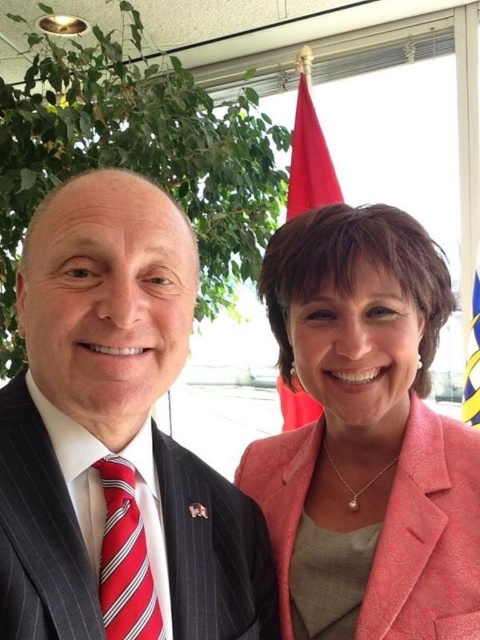
You are a photographer setting up for an event. You need to position a camera so that the pinstriped suit at center and the red fabric flag at upper center are both in frame. Based on their positions, which object should you focus on first to ensure both are captured clearly?

The pinstriped suit at center is located below the red fabric flag at upper center. To capture both clearly, focus on the red fabric flag at upper center first as it is higher up, ensuring the camera angle includes both the upper and lower areas of the scene.

You are taking a photo of two points in the scene. The first point is labeled as point (131, 417) and the second is point (140, 541). Which point will appear larger in your photo?

Point (131, 417) is closer to the camera than point (140, 541), so it will appear larger in the photo.

Based on the coordinates provided, which object in the scene is located at point (107, 301)?

The pinstriped suit at center is located at point (107, 301).